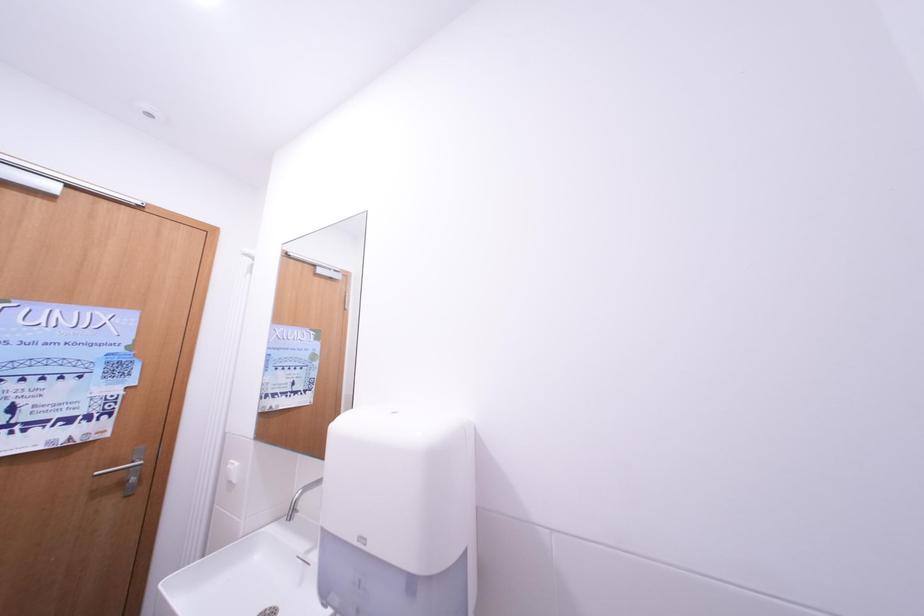
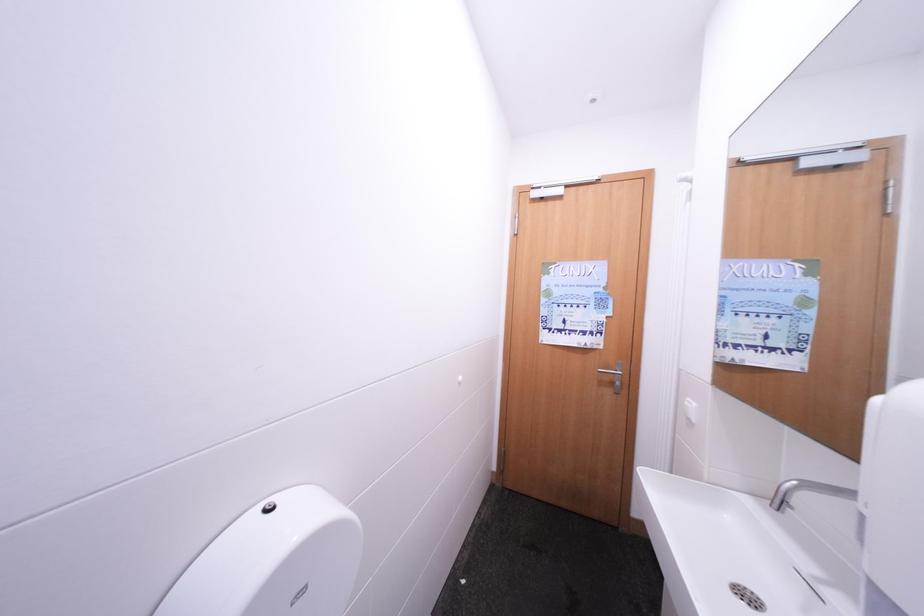
Question: The first image is from the beginning of the video and the second image is from the end. How did the camera likely rotate when shooting the video?

Choices:
 (A) Left
 (B) Right
 (C) Up
 (D) Down

Answer: (A)